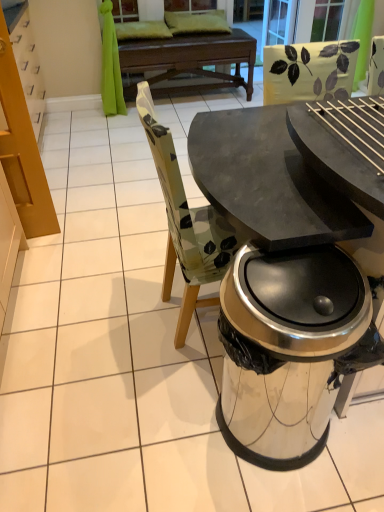
Question: Is there a large distance between shiny metallic trash can at lower right and transparent glass screen door at upper center, which is the 1th screen door in left-to-right order?

Choices:
 (A) yes
 (B) no

Answer: (A)

Question: Is transparent glass screen door at upper center, which is the 1th screen door in left-to-right order, located within shiny metallic trash can at lower right?

Choices:
 (A) no
 (B) yes

Answer: (A)

Question: From a real-world perspective, is shiny metallic trash can at lower right positioned over transparent glass screen door at upper center, which is the 1th screen door in left-to-right order, based on gravity?

Choices:
 (A) yes
 (B) no

Answer: (B)

Question: From the image's perspective, would you say shiny metallic trash can at lower right is shown under transparent glass screen door at upper center, the 2th screen door positioned from the right?

Choices:
 (A) no
 (B) yes

Answer: (B)

Question: Is transparent glass screen door at upper center, which is the 1th screen door in left-to-right order, at the back of shiny metallic trash can at lower right?

Choices:
 (A) no
 (B) yes

Answer: (B)

Question: Is transparent glass screen door at upper center, which is the 1th screen door in left-to-right order, inside or outside of shiny metallic trash can at lower right?

Choices:
 (A) outside
 (B) inside

Answer: (A)

Question: Looking at the image, does transparent glass screen door at upper center, the 2th screen door positioned from the right, seem bigger or smaller compared to shiny metallic trash can at lower right?

Choices:
 (A) small
 (B) big

Answer: (A)

Question: Does point (289, 2) appear closer or farther from the camera than point (256, 314)?

Choices:
 (A) closer
 (B) farther

Answer: (B)

Question: Considering the positions of transparent glass screen door at upper center, which is the 1th screen door in left-to-right order, and shiny metallic trash can at lower right in the image, is transparent glass screen door at upper center, which is the 1th screen door in left-to-right order, wider or thinner than shiny metallic trash can at lower right?

Choices:
 (A) thin
 (B) wide

Answer: (A)

Question: From a real-world perspective, is dark wood round table at center positioned above or below clear glass screen door at upper center, which is the 1th screen door from right to left?

Choices:
 (A) below
 (B) above

Answer: (A)

Question: Does point (172, 71) appear closer or farther from the camera than point (322, 32)?

Choices:
 (A) closer
 (B) farther

Answer: (A)

Question: Considering their positions, is dark wood round table at center located in front of or behind clear glass screen door at upper center, which is the 1th screen door from right to left?

Choices:
 (A) behind
 (B) front

Answer: (B)

Question: Based on their positions, is dark wood round table at center located to the left or right of clear glass screen door at upper center, which is the 1th screen door from right to left?

Choices:
 (A) right
 (B) left

Answer: (B)

Question: Does point (332, 2) appear closer or farther from the camera than point (240, 111)?

Choices:
 (A) closer
 (B) farther

Answer: (B)

Question: From a real-world perspective, is clear glass screen door at upper center, which is the 1th screen door from right to left, positioned above or below matte black table at center?

Choices:
 (A) above
 (B) below

Answer: (A)